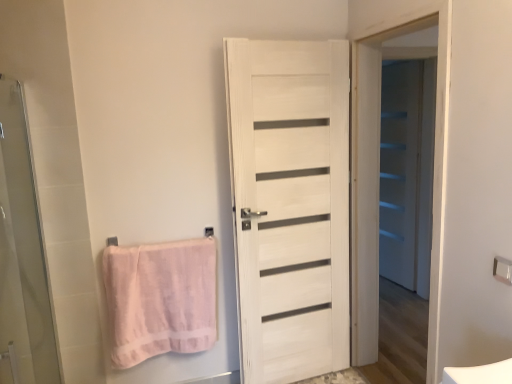
What is the approximate height of pink fabric towel bar at lower left, the 1th towel bar viewed from the back?

8.51 centimeters.

This screenshot has width=512, height=384. Describe the element at coordinates (22, 254) in the screenshot. I see `transparent glass screen door at left, the 3th screen door in the right-to-left sequence` at that location.

You are a GUI agent. You are given a task and a screenshot of the screen. Output one action in this format:
    pyautogui.click(x=<x>, y=<y>)
    Task: Click on the transparent glass screen door at left, which appears as the first screen door when viewed from the left
    Image resolution: width=512 pixels, height=384 pixels.
    Given the screenshot: What is the action you would take?
    pyautogui.click(x=22, y=254)

This screenshot has width=512, height=384. What do you see at coordinates (378, 177) in the screenshot?
I see `white wooden door at center, which is the 2th screen door in right-to-left order` at bounding box center [378, 177].

What are the coordinates of `white matte screen door at right, which appears as the third screen door when viewed from the front` in the screenshot? It's located at (400, 170).

At what (x,y) coordinates should I click in order to perform the action: click on white wood door at center. Please return your answer as a coordinate pair (x, y). Looking at the image, I should click on (290, 205).

What do you see at coordinates (290, 205) in the screenshot? I see `white wood door at center` at bounding box center [290, 205].

Identify the location of pink cotton towel at left. Image resolution: width=512 pixels, height=384 pixels. (160, 299).

From the image's perspective, is pink cotton towel at left on top of white wooden door at center, marked as the second screen door in a front-to-back arrangement?

No.

From a real-world perspective, who is located lower, pink cotton towel at left or white wooden door at center, the second screen door when ordered from left to right?

From a 3D spatial view, pink cotton towel at left is below.

Which object is further away from the camera taking this photo, pink cotton towel at left or white wooden door at center, the second screen door when ordered from left to right?

pink cotton towel at left.

Does pink cotton towel at left touch white wooden door at center, marked as the second screen door in a front-to-back arrangement?

pink cotton towel at left is not next to white wooden door at center, marked as the second screen door in a front-to-back arrangement, and they're not touching.

Consider the image. Considering the relative sizes of white wood door at center and pink cotton towel at left in the image provided, is white wood door at center shorter than pink cotton towel at left?

Incorrect, the height of white wood door at center does not fall short of that of pink cotton towel at left.

Is white wood door at center placed right next to pink cotton towel at left?

No, white wood door at center is not making contact with pink cotton towel at left.

Which object is positioned more to the left, white wood door at center or pink cotton towel at left?

Positioned to the left is pink cotton towel at left.

In the scene shown: Does white wood door at center turn towards pink cotton towel at left?

No, white wood door at center is not facing towards pink cotton towel at left.

From the image's perspective, between white wood door at center and metallic silver towel bar at upper right, which is counted as the second towel bar, starting from the back, which one is located above?

white wood door at center.

Between white wood door at center and metallic silver towel bar at upper right, acting as the first towel bar starting from the right, which one has smaller width?

Thinner between the two is metallic silver towel bar at upper right, acting as the first towel bar starting from the right.

From a real-world perspective, is white wood door at center below metallic silver towel bar at upper right, positioned as the first towel bar in front-to-back order?

Yes, from a real-world perspective, white wood door at center is beneath metallic silver towel bar at upper right, positioned as the first towel bar in front-to-back order.

From the image's perspective, is pink cotton towel at left located beneath pink fabric towel bar at lower left, which appears as the 1th towel bar when viewed from the left?

Yes, from the image's perspective, pink cotton towel at left is below pink fabric towel bar at lower left, which appears as the 1th towel bar when viewed from the left.

Would you say pink cotton towel at left contains pink fabric towel bar at lower left, arranged as the 2th towel bar when viewed from the front?

Actually, pink fabric towel bar at lower left, arranged as the 2th towel bar when viewed from the front, is outside pink cotton towel at left.

Does point (164, 295) come closer to viewer compared to point (212, 235)?

Yes.

Is pink cotton towel at left to the right of pink fabric towel bar at lower left, which appears as the second towel bar when viewed from the right, from the viewer's perspective?

Correct, you'll find pink cotton towel at left to the right of pink fabric towel bar at lower left, which appears as the second towel bar when viewed from the right.

Considering the relative positions of white wood door at center and white matte screen door at right, placed as the 1th screen door when sorted from right to left, in the image provided, is white wood door at center to the left of white matte screen door at right, placed as the 1th screen door when sorted from right to left, from the viewer's perspective?

Yes.

From a real-world perspective, is white wood door at center below white matte screen door at right, positioned as the third screen door in left-to-right order?

Incorrect, from a real-world perspective, white wood door at center is higher than white matte screen door at right, positioned as the third screen door in left-to-right order.

How many degrees apart are the facing directions of white wood door at center and white matte screen door at right, placed as the 1th screen door when sorted from right to left?

The angular difference between white wood door at center and white matte screen door at right, placed as the 1th screen door when sorted from right to left, is 65.9 degrees.

Considering the sizes of objects white wood door at center and white matte screen door at right, the 1th screen door positioned from the back, in the image provided, who is bigger, white wood door at center or white matte screen door at right, the 1th screen door positioned from the back,?

With larger size is white wood door at center.

Which is nearer, [500,268] or [241,289]?

Point [500,268].

How distant is metallic silver towel bar at upper right, acting as the first towel bar starting from the right, from white wood door at center?

They are 4.08 feet apart.

Is metallic silver towel bar at upper right, positioned as the first towel bar in front-to-back order, further to camera compared to white wood door at center?

No.

Is there a large distance between metallic silver towel bar at upper right, which is counted as the second towel bar, starting from the back, and white wood door at center?

Yes, metallic silver towel bar at upper right, which is counted as the second towel bar, starting from the back, is far from white wood door at center.

Would you say transparent glass screen door at left, the 3th screen door in the right-to-left sequence, contains white matte screen door at right, placed as the 1th screen door when sorted from right to left?

Definitely not — white matte screen door at right, placed as the 1th screen door when sorted from right to left, is not inside transparent glass screen door at left, the 3th screen door in the right-to-left sequence.

Based on their positions, is transparent glass screen door at left, the 1th screen door when ordered from front to back, located to the left or right of white matte screen door at right, placed as the 1th screen door when sorted from right to left?

transparent glass screen door at left, the 1th screen door when ordered from front to back, is to the left of white matte screen door at right, placed as the 1th screen door when sorted from right to left.

From the image's perspective, which screen door is the 2nd one below the white matte screen door at right, which appears as the third screen door when viewed from the front? Please provide its 2D coordinates.

[(22, 254)]

Is transparent glass screen door at left, which appears as the first screen door when viewed from the left, placed right next to white matte screen door at right, positioned as the third screen door in left-to-right order?

transparent glass screen door at left, which appears as the first screen door when viewed from the left, and white matte screen door at right, positioned as the third screen door in left-to-right order, are clearly separated.

Locate an element on the screen. This screenshot has width=512, height=384. towel on the left of white wooden door at center, marked as the second screen door in a front-to-back arrangement is located at coordinates (160, 299).

Locate an element on the screen. door above the pink cotton towel at left (from a real-world perspective) is located at coordinates (290, 205).

When comparing their distances from white wooden door at center, marked as the second screen door in a front-to-back arrangement, does metallic silver towel bar at upper right, which is counted as the second towel bar, starting from the back, or transparent glass screen door at left, which appears as the first screen door when viewed from the left, seem closer?

metallic silver towel bar at upper right, which is counted as the second towel bar, starting from the back.

Based on their spatial positions, is transparent glass screen door at left, the 1th screen door when ordered from front to back, or pink fabric towel bar at lower left, the 1th towel bar viewed from the back, further from metallic silver towel bar at upper right, which is counted as the second towel bar, starting from the back?

transparent glass screen door at left, the 1th screen door when ordered from front to back, is positioned further to the anchor metallic silver towel bar at upper right, which is counted as the second towel bar, starting from the back.

Looking at the image, which one is located further to white wooden door at center, which is the 2th screen door in right-to-left order, white matte screen door at right, the 1th screen door positioned from the back, or pink fabric towel bar at lower left, the 1th towel bar viewed from the back?

pink fabric towel bar at lower left, the 1th towel bar viewed from the back, is positioned further to the anchor white wooden door at center, which is the 2th screen door in right-to-left order.

Based on their spatial positions, is white wooden door at center, marked as the second screen door in a front-to-back arrangement, or pink fabric towel bar at lower left, which appears as the second towel bar when viewed from the right, further from pink cotton towel at left?

Based on the image, white wooden door at center, marked as the second screen door in a front-to-back arrangement, appears to be further to pink cotton towel at left.

Based on their spatial positions, is pink cotton towel at left or metallic silver towel bar at upper right, positioned as the first towel bar in front-to-back order, closer to white wooden door at center, the second screen door when ordered from left to right?

metallic silver towel bar at upper right, positioned as the first towel bar in front-to-back order, is positioned closer to the anchor white wooden door at center, the second screen door when ordered from left to right.

When comparing their distances from transparent glass screen door at left, which appears as the first screen door when viewed from the left, does pink cotton towel at left or white wooden door at center, marked as the second screen door in a front-to-back arrangement, seem further?

Among the two, white wooden door at center, marked as the second screen door in a front-to-back arrangement, is located further to transparent glass screen door at left, which appears as the first screen door when viewed from the left.

Estimate the real-world distances between objects in this image. Which object is closer to white wood door at center, pink fabric towel bar at lower left, which appears as the 1th towel bar when viewed from the left, or transparent glass screen door at left, arranged as the 3th screen door when viewed from the back?

The object closer to white wood door at center is pink fabric towel bar at lower left, which appears as the 1th towel bar when viewed from the left.

Based on their spatial positions, is pink fabric towel bar at lower left, the 1th towel bar viewed from the back, or pink cotton towel at left further from white wood door at center?

pink fabric towel bar at lower left, the 1th towel bar viewed from the back, lies further to white wood door at center than the other object.

This screenshot has width=512, height=384. Find the location of `towel between transparent glass screen door at left, the 3th screen door in the right-to-left sequence, and metallic silver towel bar at upper right, which is the second towel bar in left-to-right order`. towel between transparent glass screen door at left, the 3th screen door in the right-to-left sequence, and metallic silver towel bar at upper right, which is the second towel bar in left-to-right order is located at coordinates (160, 299).

Identify the location of towel between transparent glass screen door at left, arranged as the 3th screen door when viewed from the back, and white matte screen door at right, which appears as the third screen door when viewed from the front, from front to back. (160, 299).

The image size is (512, 384). I want to click on door between pink fabric towel bar at lower left, arranged as the 2th towel bar when viewed from the front, and metallic silver towel bar at upper right, acting as the first towel bar starting from the right, in the horizontal direction, so click(x=290, y=205).

Find the location of `door between pink cotton towel at left and metallic silver towel bar at upper right, positioned as the first towel bar in front-to-back order, in the horizontal direction`. door between pink cotton towel at left and metallic silver towel bar at upper right, positioned as the first towel bar in front-to-back order, in the horizontal direction is located at coordinates (290, 205).